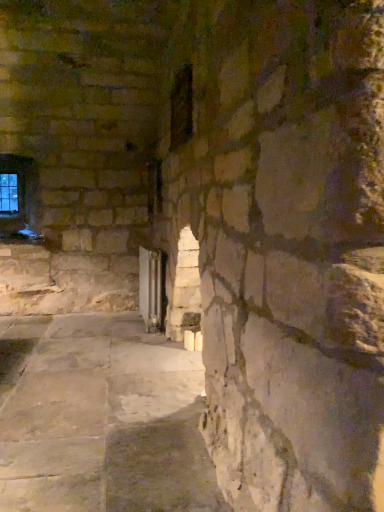
Question: In which direction should I rotate to look at dark glass window at center, marked as the 1th window in a right-to-left arrangement?

Choices:
 (A) left
 (B) right

Answer: (A)

Question: From the image's perspective, would you say clear glass window at upper left, the 1th window from the back, is shown under transparent glass door at center?

Choices:
 (A) yes
 (B) no

Answer: (B)

Question: Are clear glass window at upper left, the 1th window from the back, and transparent glass door at center located far from each other?

Choices:
 (A) yes
 (B) no

Answer: (A)

Question: Does clear glass window at upper left, which is the second window in front-to-back order, turn towards transparent glass door at center?

Choices:
 (A) yes
 (B) no

Answer: (B)

Question: Does clear glass window at upper left, the 2th window when ordered from right to left, have a larger size compared to transparent glass door at center?

Choices:
 (A) yes
 (B) no

Answer: (B)

Question: Does clear glass window at upper left, the 2th window when ordered from right to left, have a lesser width compared to transparent glass door at center?

Choices:
 (A) no
 (B) yes

Answer: (B)

Question: Is clear glass window at upper left, the 2th window when ordered from right to left, at the right side of transparent glass door at center?

Choices:
 (A) no
 (B) yes

Answer: (A)

Question: Is transparent glass door at center taller than dark glass window at center, the second window positioned from the back?

Choices:
 (A) yes
 (B) no

Answer: (A)

Question: Is dark glass window at center, marked as the 1th window in a right-to-left arrangement, at the back of transparent glass door at center?

Choices:
 (A) yes
 (B) no

Answer: (B)

Question: From a real-world perspective, does transparent glass door at center sit lower than dark glass window at center, marked as the 1th window in a right-to-left arrangement?

Choices:
 (A) no
 (B) yes

Answer: (B)

Question: Can you confirm if transparent glass door at center is thinner than dark glass window at center, placed as the 1th window when sorted from front to back?

Choices:
 (A) no
 (B) yes

Answer: (A)

Question: Is the surface of transparent glass door at center in direct contact with dark glass window at center, marked as the 2th window in a left-to-right arrangement?

Choices:
 (A) no
 (B) yes

Answer: (A)

Question: From the image's perspective, is transparent glass door at center on top of dark glass window at center, the second window positioned from the back?

Choices:
 (A) no
 (B) yes

Answer: (A)

Question: From a real-world perspective, does dark glass window at center, placed as the 1th window when sorted from front to back, stand above transparent glass door at center?

Choices:
 (A) no
 (B) yes

Answer: (B)